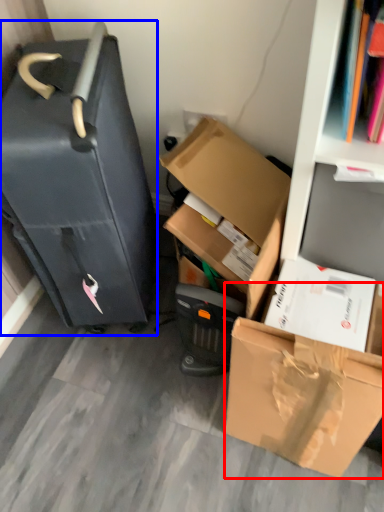
Question: Which object appears farthest to the camera in this image, box (highlighted by a red box) or suitcase (highlighted by a blue box)?

Choices:
 (A) box
 (B) suitcase

Answer: (B)